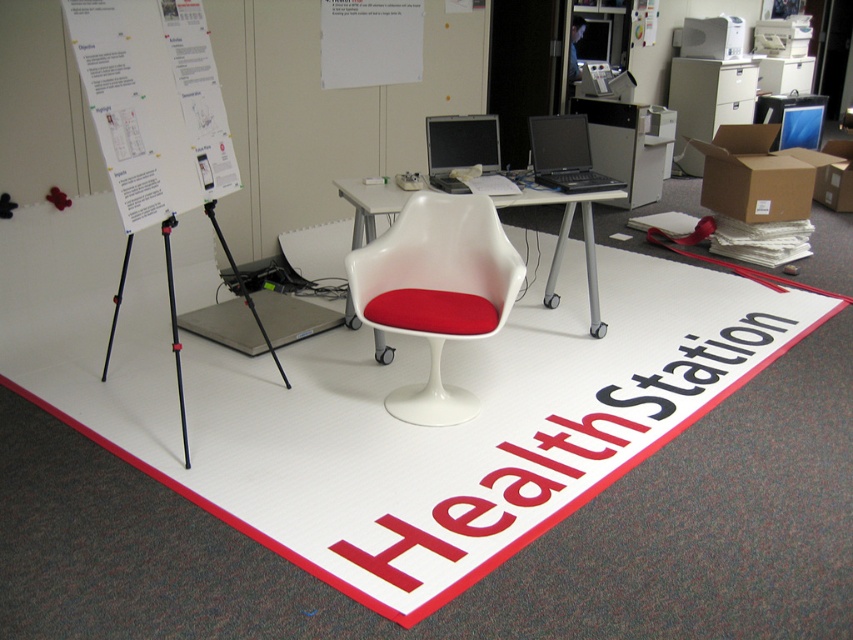
You are organizing a health fair and need to set up materials. You have a white paper at upper left and a black glossy laptop at center. Which object is taller?

The white paper at upper left is taller than the black glossy laptop at center.